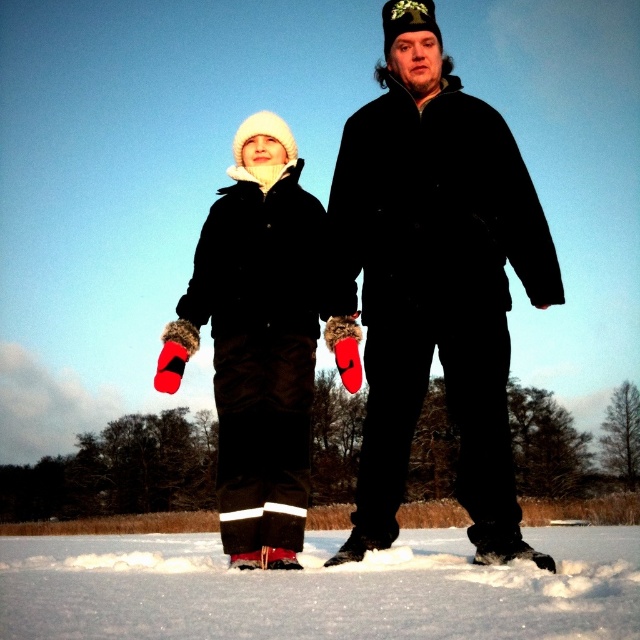
Question: Among these objects, which one is nearest to the camera?

Choices:
 (A) white fluffy snow at lower center
 (B) fuzzy red mittens at left
 (C) matte black coat at center

Answer: (A)

Question: Can you confirm if matte black coat at center is wider than white fluffy snow at lower center?

Choices:
 (A) yes
 (B) no

Answer: (B)

Question: Estimate the real-world distances between objects in this image. Which object is farther from the fuzzy red mittens at left?

Choices:
 (A) white fluffy snow at lower center
 (B) matte black coat at center

Answer: (A)

Question: Which object is positioned closest to the white fluffy snow at lower center?

Choices:
 (A) matte black coat at center
 (B) fuzzy red mittens at left

Answer: (A)

Question: Can you confirm if matte black coat at center is positioned to the right of fuzzy red mittens at left?

Choices:
 (A) yes
 (B) no

Answer: (A)

Question: Can you confirm if matte black coat at center is positioned to the left of fuzzy red mittens at left?

Choices:
 (A) no
 (B) yes

Answer: (A)